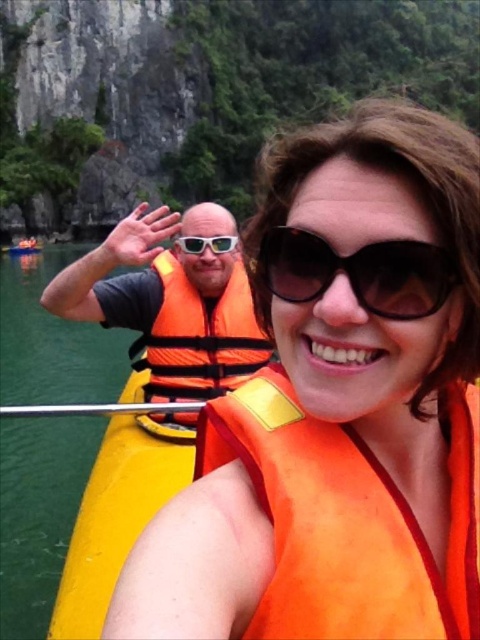
You are a photographer trying to capture a clear shot of the orange fabric life jacket at left and the white plastic goggles at center. Which object appears taller in the photo?

The white plastic goggles at center are taller than the orange fabric life jacket at left.

You are on a boat and need to choose between the orange life vest at center and the yellow plastic paddle at center to store in a small compartment. Which item will fit better?

The orange life vest at center is smaller than the yellow plastic paddle at center, so it will fit better in the small compartment.

Consider the image. You are navigating a small boat and need to place an orange fabric life vest at center. According to the image, where should you place it?

The orange fabric life vest at center should be placed at point (347, 518) as per the coordinates provided.